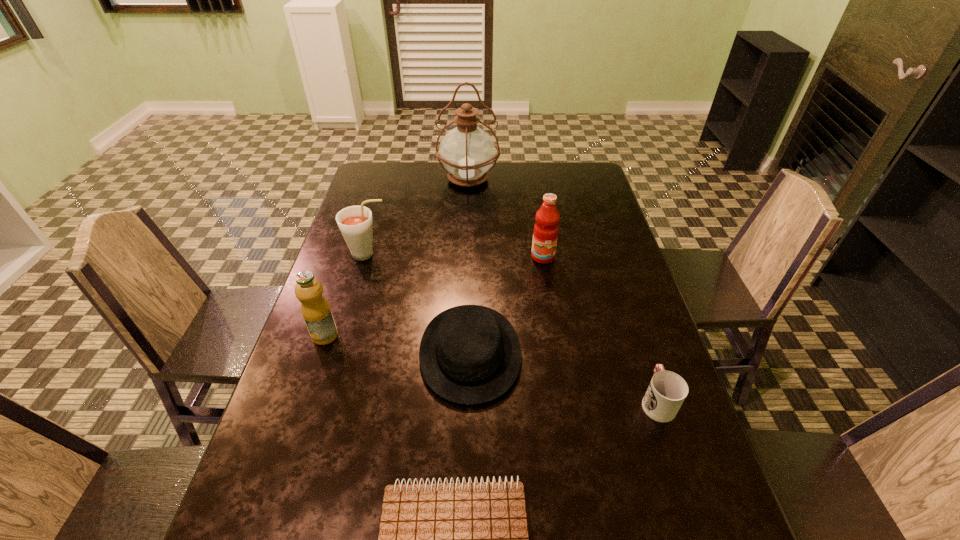
This screenshot has height=540, width=960. I want to click on free space at the far edge of the desktop, so click(x=530, y=193).

The image size is (960, 540). In the image, there is a desktop. What are the coordinates of `vacant region at the left edge` in the screenshot? It's located at (320, 407).

In the image, there is a desktop. Where is `vacant space at the right edge`? Image resolution: width=960 pixels, height=540 pixels. vacant space at the right edge is located at coordinates (714, 510).

At what (x,y) coordinates should I click in order to perform the action: click on free region at the far left corner. Please return your answer as a coordinate pair (x, y). The height and width of the screenshot is (540, 960). Looking at the image, I should click on (368, 181).

I want to click on free space between the cup and the second object from right to left, so click(600, 329).

The width and height of the screenshot is (960, 540). In order to click on free space between the left fruit juice and the root beer in this screenshot , I will do `click(347, 295)`.

Find the location of a particular element. free spot between the farther fruit juice and the rightmost object is located at coordinates (600, 329).

At what (x,y) coordinates should I click in order to perform the action: click on blank region between the farthest object and the sixth object from left to right. Please return your answer as a coordinate pair (x, y). Looking at the image, I should click on (x=506, y=218).

The width and height of the screenshot is (960, 540). I want to click on free space between the left fruit juice and the fedora, so click(x=397, y=344).

I want to click on unoccupied area between the right fruit juice and the oil lamp, so [506, 218].